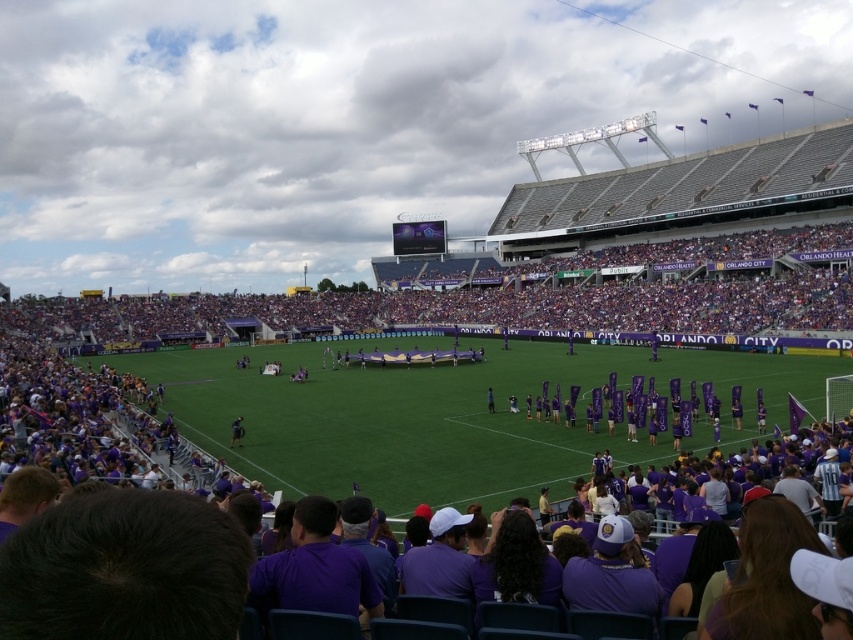
Between point (426, 390) and point (241, 428), which one is positioned in front?

Point (241, 428) is more forward.

The image size is (853, 640). What are the coordinates of `green grass football field at center` in the screenshot? It's located at (444, 416).

Does point (183, 371) come in front of point (235, 440)?

No, it is not.

Where is `green grass football field at center`? This screenshot has width=853, height=640. green grass football field at center is located at coordinates (444, 416).